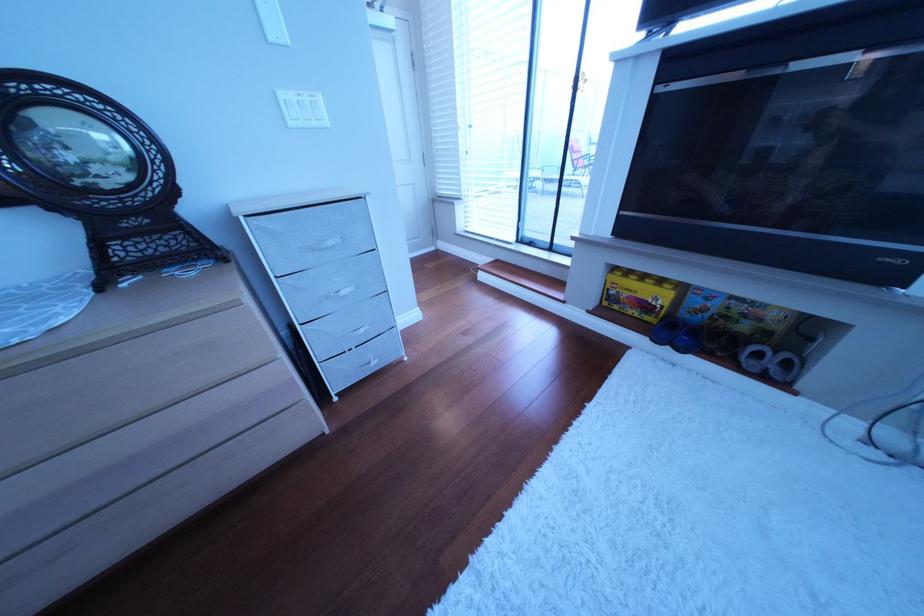
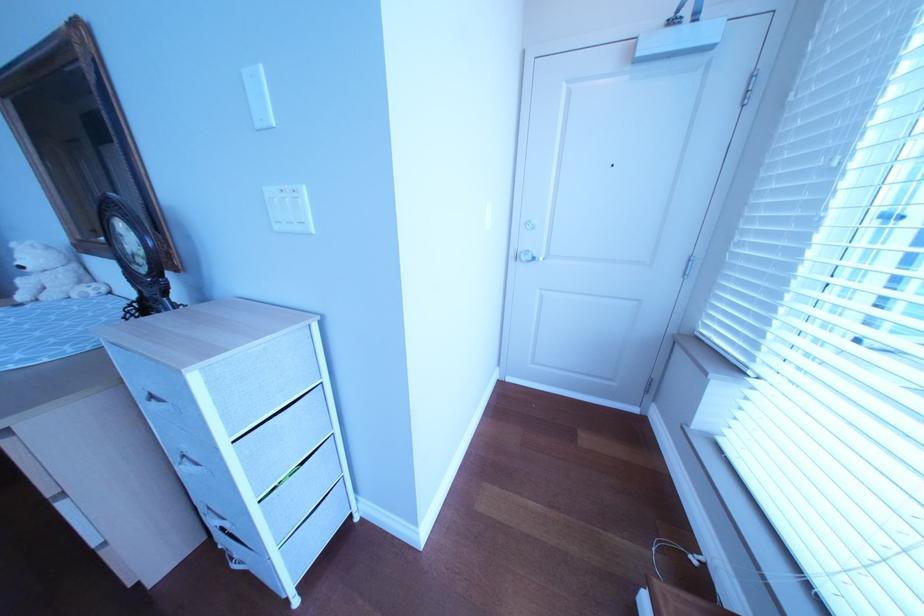
Find the pixel in the second image that matches point 307,126 in the first image.

(292, 229)